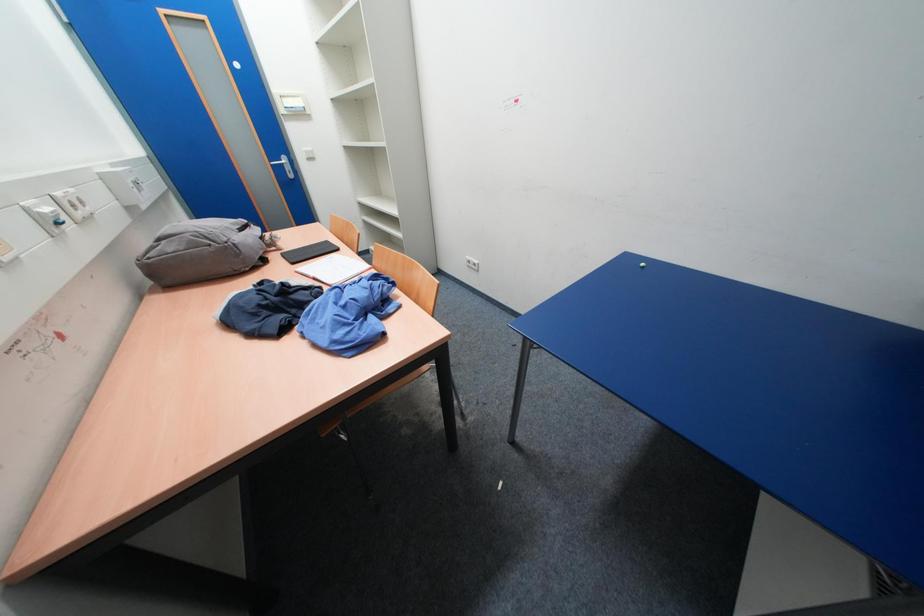
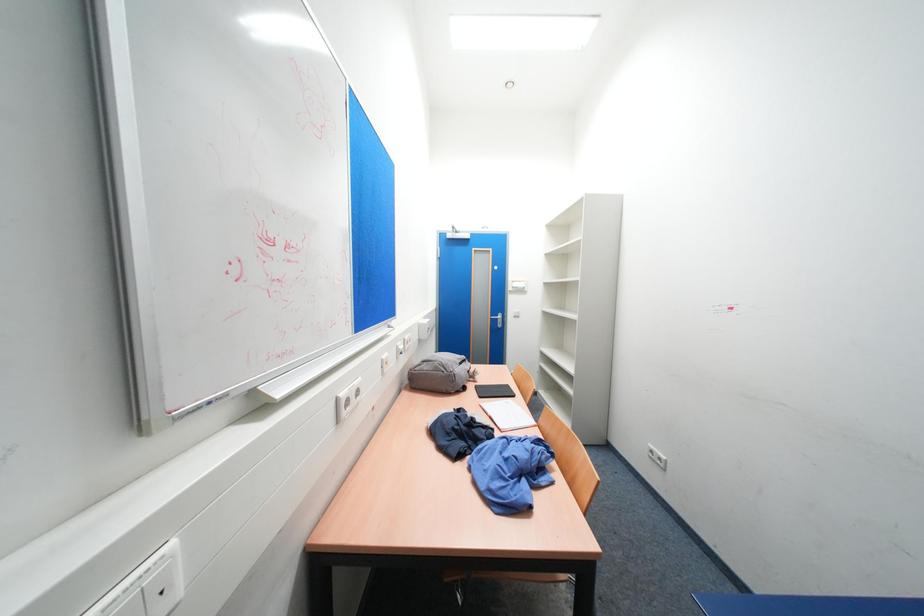
The first image is from the beginning of the video and the second image is from the end. How did the camera likely rotate when shooting the video?

The camera rotated toward left-up.